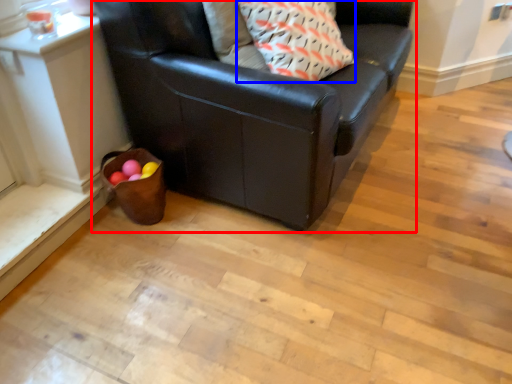
Question: Which object appears closest to the camera in this image, studio couch (highlighted by a red box) or throw pillow (highlighted by a blue box)?

Choices:
 (A) studio couch
 (B) throw pillow

Answer: (A)